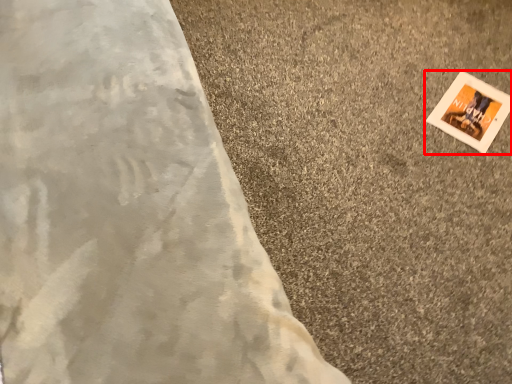
Question: Where is picture frame (annotated by the red box) located in relation to concrete in the image?

Choices:
 (A) left
 (B) right

Answer: (B)